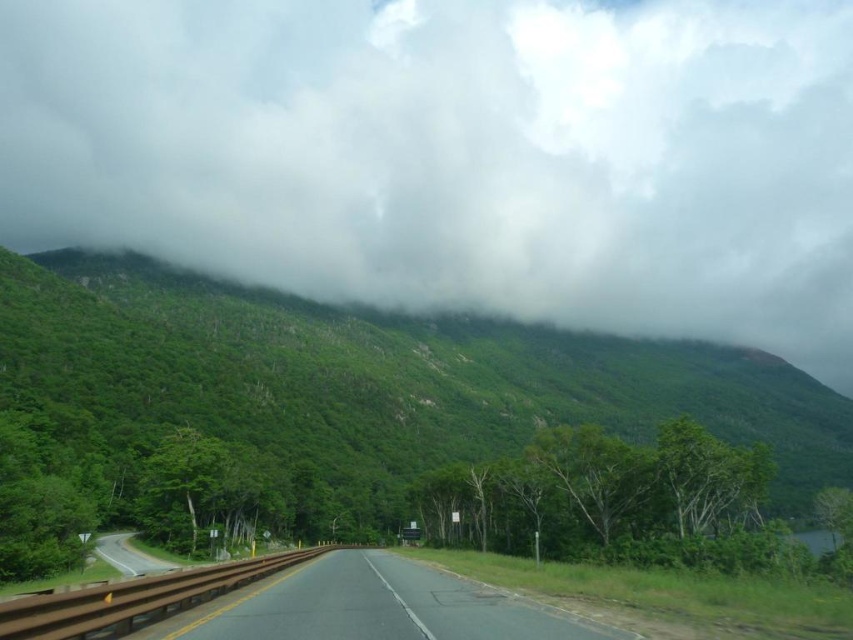
Question: Among these objects, which one is farthest from the camera?

Choices:
 (A) asphalt road at lower left
 (B) black asphalt highway at center

Answer: (A)

Question: Is black asphalt highway at center to the right of asphalt road at lower left from the viewer's perspective?

Choices:
 (A) yes
 (B) no

Answer: (A)

Question: Which point is farther from the camera taking this photo?

Choices:
 (A) (299, 609)
 (B) (138, 556)
 (C) (36, 288)

Answer: (C)

Question: Does green leafy forest at upper center have a larger size compared to asphalt road at lower left?

Choices:
 (A) yes
 (B) no

Answer: (A)

Question: Is green leafy forest at upper center below asphalt road at lower left?

Choices:
 (A) yes
 (B) no

Answer: (B)

Question: Which object appears closest to the camera in this image?

Choices:
 (A) asphalt road at lower left
 (B) green leafy forest at upper center
 (C) black asphalt highway at center
 (D) white fluffy cloud at upper center

Answer: (C)